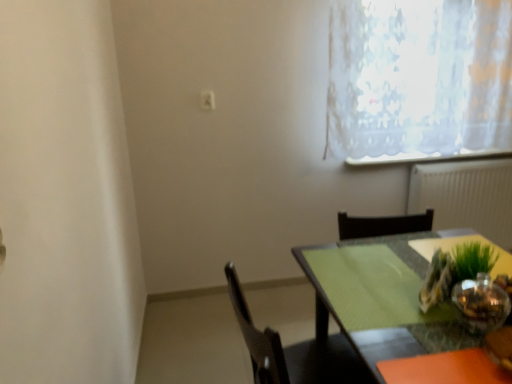
Question: In terms of width, does green glass table at center, the first chair in the top-to-bottom sequence, look wider or thinner when compared to white textured radiator at right?

Choices:
 (A) wide
 (B) thin

Answer: (A)

Question: From the image's perspective, is green glass table at center, the second chair in the bottom-to-top sequence, above or below white textured radiator at right?

Choices:
 (A) below
 (B) above

Answer: (A)

Question: Which of these objects is positioned closest to the green matte table at lower right?

Choices:
 (A) green glass vase at right
 (B) black matte chair at lower center, which is the 1th chair in bottom-to-top order
 (C) white textured radiator at right
 (D) white lace curtain at upper right
 (E) green glass table at center, the first chair in the top-to-bottom sequence

Answer: (A)

Question: Which object is positioned closest to the white lace curtain at upper right?

Choices:
 (A) green glass table at center, the second chair in the bottom-to-top sequence
 (B) white textured radiator at right
 (C) black matte chair at lower center, which is the 1th chair in bottom-to-top order
 (D) green matte table at lower right
 (E) green glass vase at right

Answer: (B)